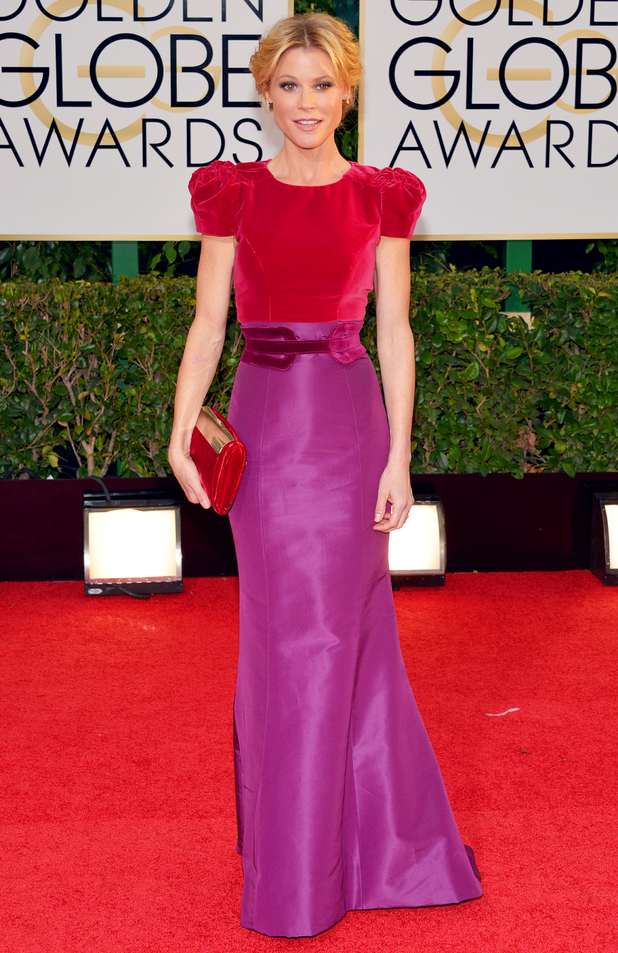
The width and height of the screenshot is (618, 953). Find the location of `carpet`. carpet is located at coordinates (492, 784).